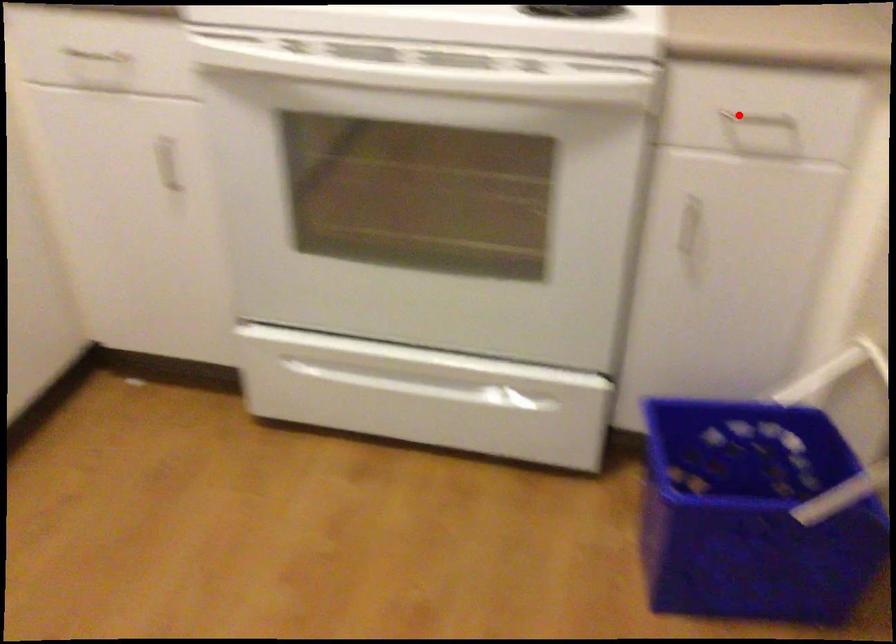
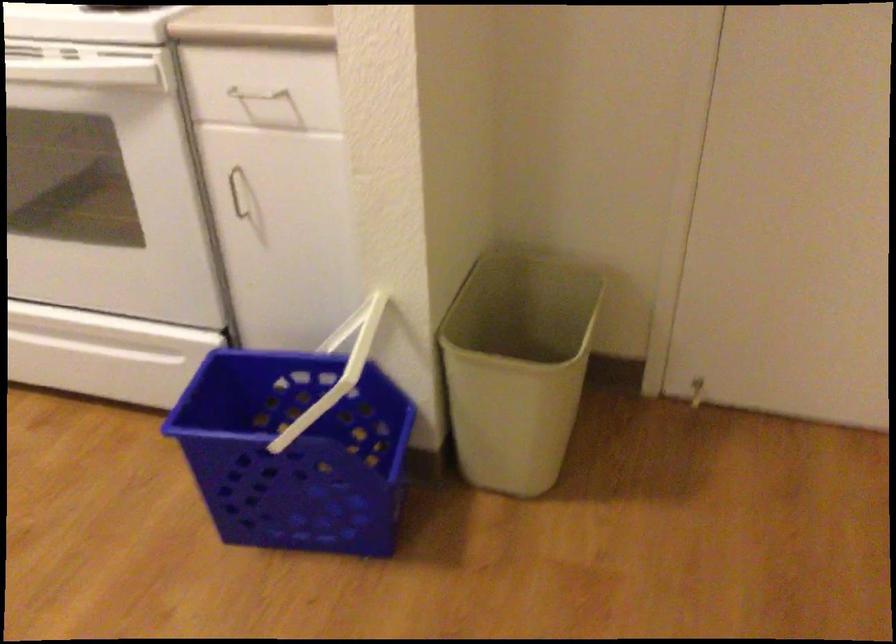
Question: I am providing you with two images of the same scene from different viewpoints. Image1 has a red point marked. In image2, the corresponding 3D location appears at what relative position? Reply with the corresponding letter.

Choices:
 (A) Closer
 (B) Farther

Answer: (B)